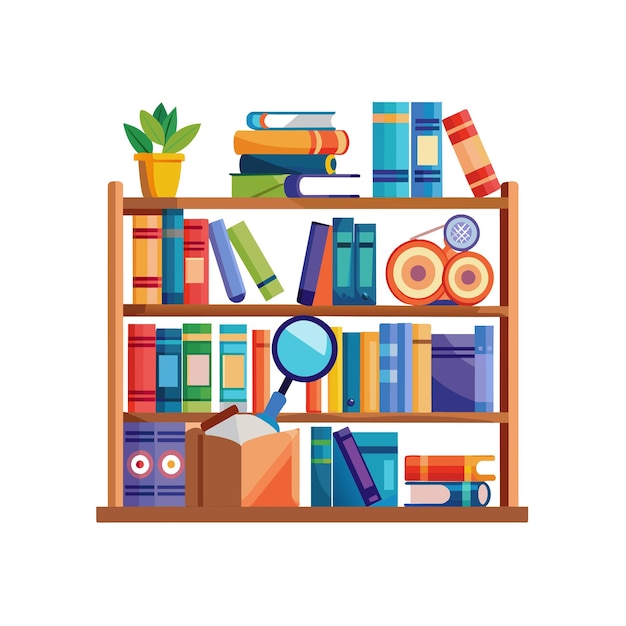
This screenshot has height=626, width=626. I want to click on book on second shelf from top, so click(x=146, y=260), click(x=171, y=260), click(x=196, y=265), click(x=228, y=272), click(x=259, y=268), click(x=309, y=277), click(x=342, y=282), click(x=365, y=287).